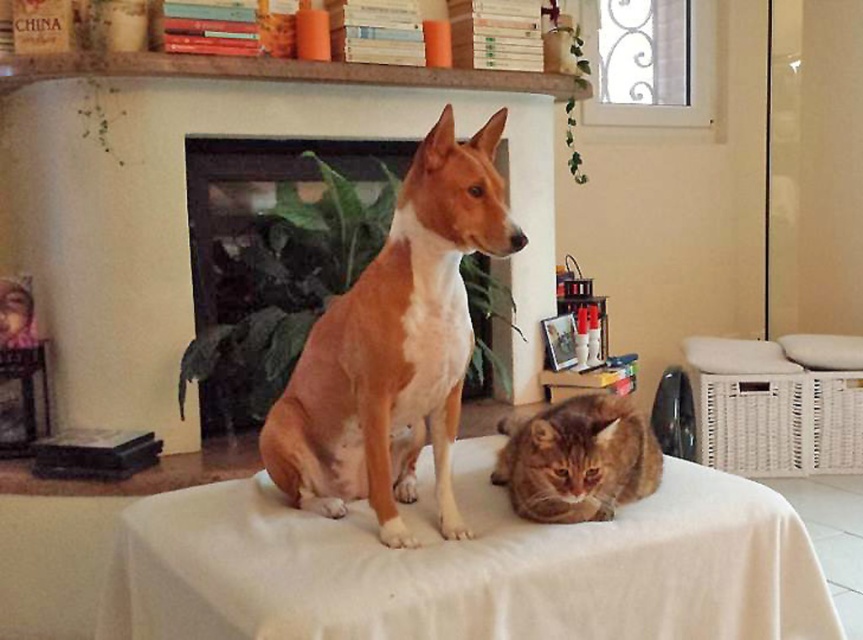
Question: Does white cloth at center lie in front of brown smooth dog at center?

Choices:
 (A) no
 (B) yes

Answer: (B)

Question: Considering the real-world distances, which object is farthest from the orange tabby cat at lower center?

Choices:
 (A) white cloth at center
 (B) brown smooth dog at center

Answer: (B)

Question: Is the position of white cloth at center less distant than that of brown smooth dog at center?

Choices:
 (A) no
 (B) yes

Answer: (B)

Question: Which of the following is the closest to the observer?

Choices:
 (A) white cloth at center
 (B) brown smooth dog at center
 (C) orange tabby cat at lower center

Answer: (A)

Question: Which object is the closest to the brown smooth dog at center?

Choices:
 (A) white cloth at center
 (B) orange tabby cat at lower center

Answer: (A)

Question: Observing the image, what is the correct spatial positioning of brown smooth dog at center in reference to orange tabby cat at lower center?

Choices:
 (A) left
 (B) right

Answer: (A)